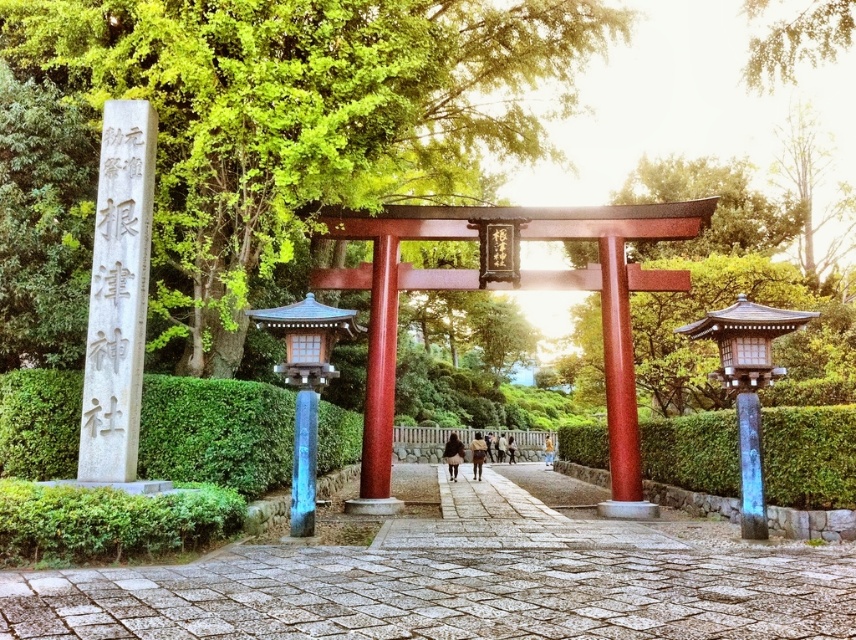
You are visiting a traditional Japanese shrine and see the gray stone path at center and the green hedge at center. According to their positions, which one is located to the left side?

The gray stone path at center is located to the left of the green hedge at center.